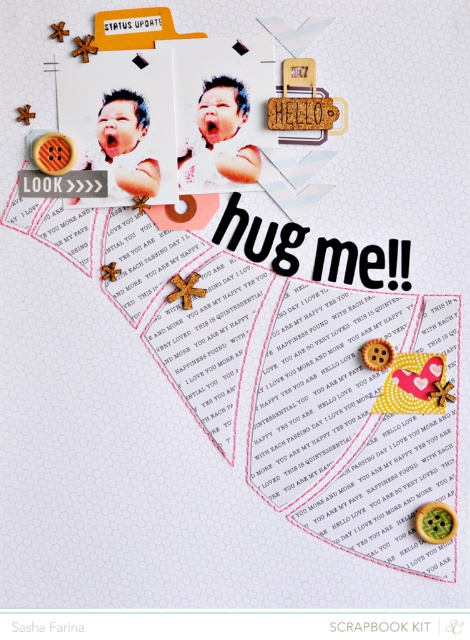
Question: Can you confirm if matte white baby at center is smaller than matte white baby at upper left?

Choices:
 (A) yes
 (B) no

Answer: (A)

Question: Does matte white baby at center appear over matte white baby at upper left?

Choices:
 (A) no
 (B) yes

Answer: (B)

Question: From the image, what is the correct spatial relationship of matte white baby at center in relation to matte white baby at upper left?

Choices:
 (A) above
 (B) below

Answer: (A)

Question: Which object appears closest to the camera in this image?

Choices:
 (A) matte white baby at center
 (B) matte white baby at upper left

Answer: (A)